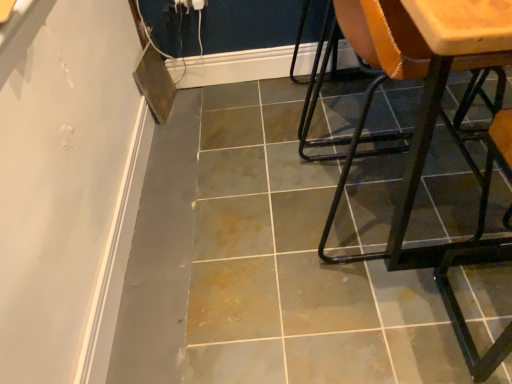
You are a GUI agent. You are given a task and a screenshot of the screen. Output one action in this format:
    pyautogui.click(x=<x>, y=<y>)
    Task: Click on the vacant area situated below metallic orange chair at right, which ranks as the 2th chair in left-to-right order (from a real-world perspective)
    The height and width of the screenshot is (384, 512).
    Given the screenshot: What is the action you would take?
    pyautogui.click(x=483, y=336)